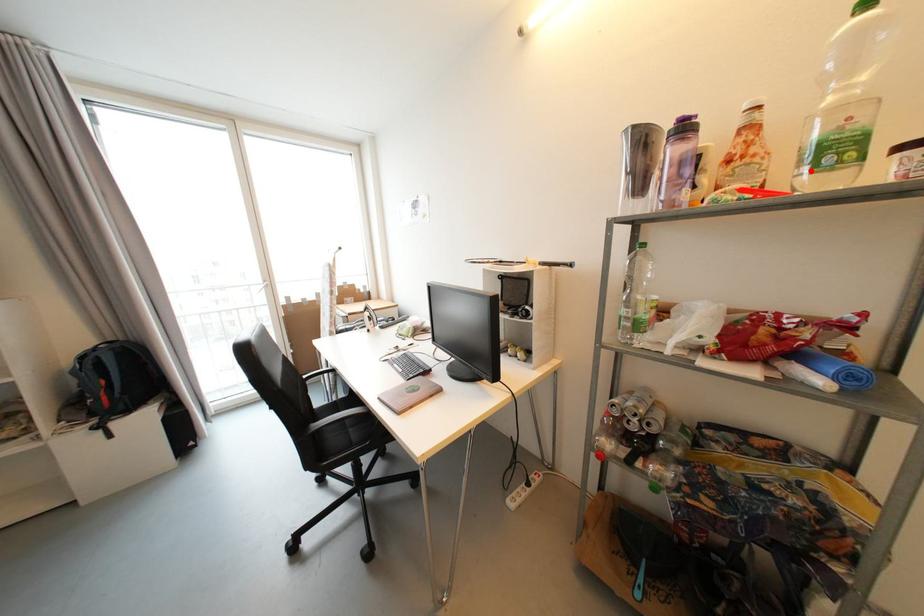
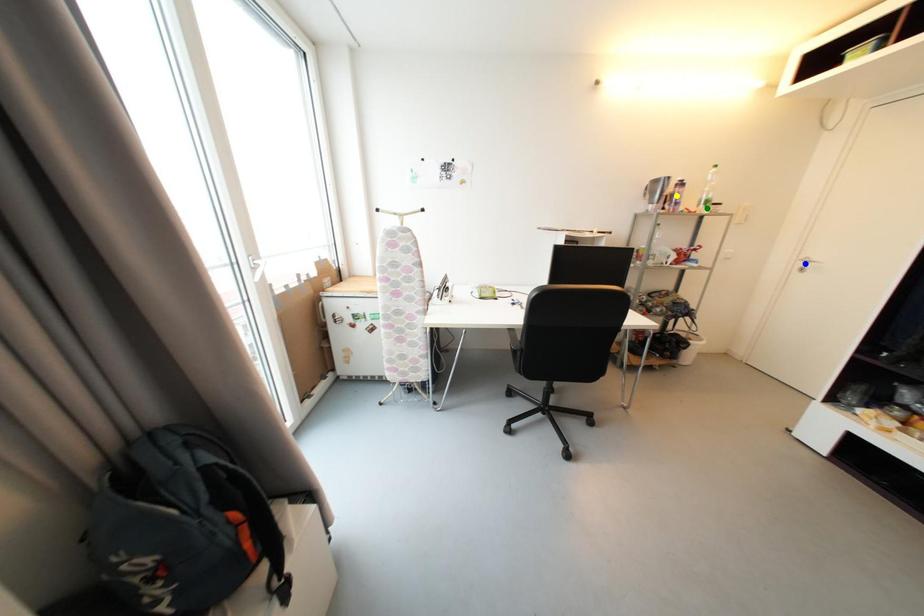
Question: I am providing you with two images of the same scene from different viewpoints. A red point is marked on the first image. You are given multiple points on the second image. Which mark in image 2 goes with the point in image 1?

Choices:
 (A) blue point
 (B) yellow point
 (C) green point

Answer: (C)